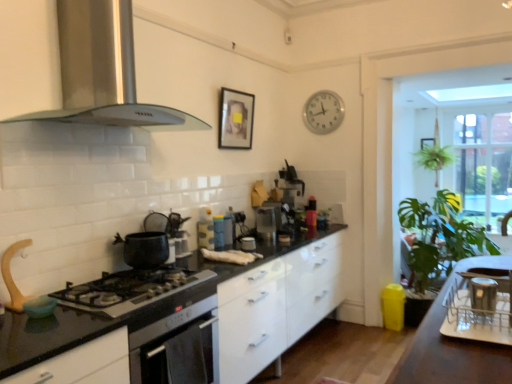
Question: From the image's perspective, is matte blue thermos at center, the fourth appliance when ordered from front to back, above or below clear glass window at right?

Choices:
 (A) below
 (B) above

Answer: (A)

Question: Considering the positions of matte blue thermos at center, which appears as the 2th appliance when viewed from the back, and clear glass window at right in the image, is matte blue thermos at center, which appears as the 2th appliance when viewed from the back, bigger or smaller than clear glass window at right?

Choices:
 (A) small
 (B) big

Answer: (A)

Question: Estimate the real-world distances between objects in this image. Which object is closer to the silver metallic clock at upper center?

Choices:
 (A) black glossy countertop at center
 (B) metallic silver kettle at center, placed as the third appliance when sorted from left to right
 (C) wooden framed picture at upper center, which appears as the 1th picture frame when viewed from the right
 (D) stainless steel range hood at upper left, which is the second kitchen appliance in bottom-to-top order
 (E) silver metallic dish rack at right, placed as the first appliance when sorted from front to back

Answer: (B)

Question: Which object is positioned farthest from the matte black pot at stove top, which is the second kitchen appliance in top-to-bottom order?

Choices:
 (A) wooden framed picture at upper center, which appears as the 1th picture frame when viewed from the right
 (B) green leafy plant at right
 (C) matte blue thermos at center, the fourth appliance when ordered from front to back
 (D) clear glass window at right
 (E) matte black kettle at center, positioned as the third appliance in front-to-back order

Answer: (A)